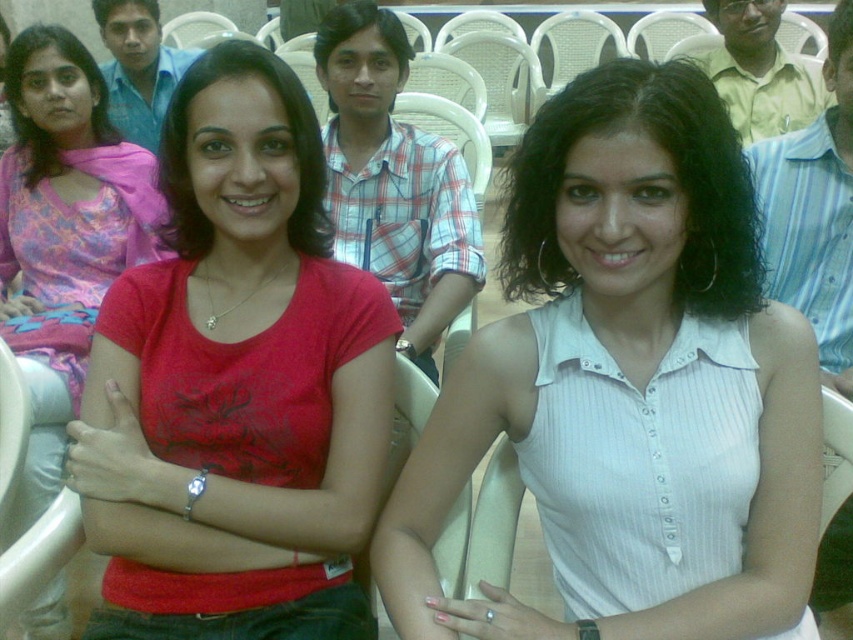
This screenshot has width=853, height=640. Identify the location of matte red shirt at center. (64, 225).

Consider the image. Can you confirm if matte red shirt at center is wider than white striped shirt at right?

Yes, matte red shirt at center is wider than white striped shirt at right.

Locate an element on the screen. matte red shirt at center is located at coordinates (64, 225).

Consider the image. Is white ribbed shirt at center to the right of plaid cotton shirt at center from the viewer's perspective?

Correct, you'll find white ribbed shirt at center to the right of plaid cotton shirt at center.

Describe the element at coordinates (640, 460) in the screenshot. Image resolution: width=853 pixels, height=640 pixels. I see `white ribbed shirt at center` at that location.

Is point (662, 566) less distant than point (387, 272)?

Yes, it is in front of point (387, 272).

Find the location of a particular element. white ribbed shirt at center is located at coordinates (640, 460).

Is matte red t-shirt at center shorter than plaid cotton shirt at center?

In fact, matte red t-shirt at center may be taller than plaid cotton shirt at center.

Is matte red t-shirt at center thinner than plaid cotton shirt at center?

Incorrect, matte red t-shirt at center's width is not less than plaid cotton shirt at center's.

Who is more distant from viewer, (212, 349) or (378, 259)?

Answer: The point (378, 259) is behind.

This screenshot has width=853, height=640. I want to click on matte red t-shirt at center, so point(236,385).